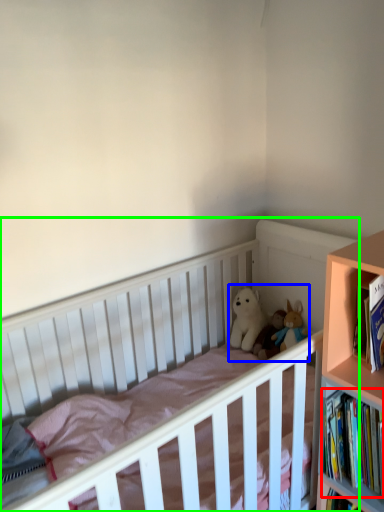
Question: Considering the real-world distances, which object is farthest from book (highlighted by a red box)? toy (highlighted by a blue box) or infant bed (highlighted by a green box)?

Choices:
 (A) toy
 (B) infant bed

Answer: (B)